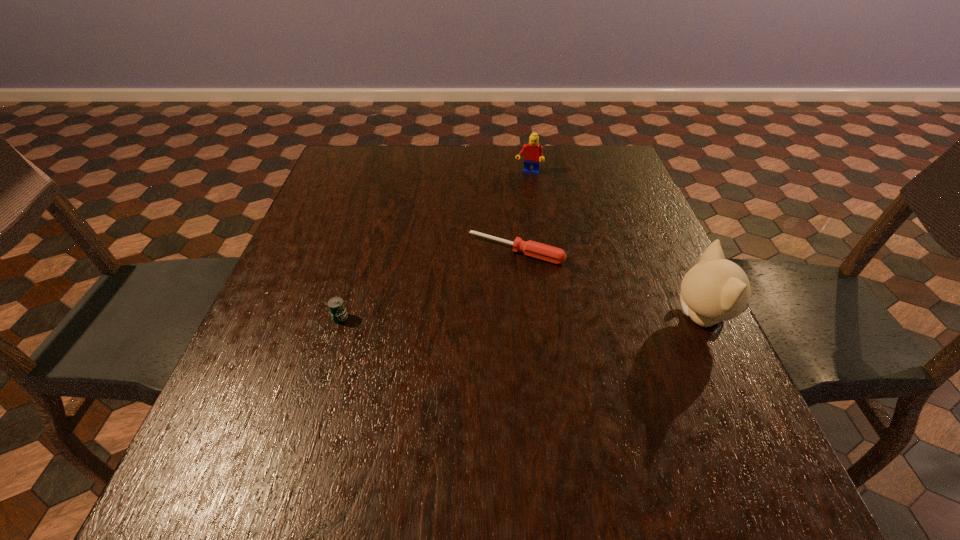
I want to click on unoccupied position between the shortest object and the farthest object, so click(x=522, y=212).

Where is `vacant area between the beer can and the rightmost object`? The height and width of the screenshot is (540, 960). vacant area between the beer can and the rightmost object is located at coordinates (520, 318).

Where is `vacant area between the leftmost object and the rightmost object`? The height and width of the screenshot is (540, 960). vacant area between the leftmost object and the rightmost object is located at coordinates click(x=520, y=318).

Identify the location of empty location between the third nearest object and the Lego. The width and height of the screenshot is (960, 540). (522, 212).

Find the location of a particular element. Image resolution: width=960 pixels, height=540 pixels. free spot between the shortest object and the Lego is located at coordinates (522, 212).

Locate which object is the closest to the kitten. Please provide its 2D coordinates. Your answer should be formatted as a tuple, i.e. [(x, y)], where the tuple contains the x and y coordinates of a point satisfying the conditions above.

[(544, 252)]

You are a GUI agent. You are given a task and a screenshot of the screen. Output one action in this format:
    pyautogui.click(x=<x>, y=<y>)
    Task: Click on the third closest object relative to the leftmost object
    The image size is (960, 540).
    Given the screenshot: What is the action you would take?
    pyautogui.click(x=716, y=289)

Image resolution: width=960 pixels, height=540 pixels. Find the location of `blank area in the image that satisfies the following two spatial constraints: 1. on the front side of the screwdriver; 2. on the face of the tallest object`. blank area in the image that satisfies the following two spatial constraints: 1. on the front side of the screwdriver; 2. on the face of the tallest object is located at coordinates (522, 319).

Locate an element on the screen. The height and width of the screenshot is (540, 960). vacant region that satisfies the following two spatial constraints: 1. on the front side of the third shortest object; 2. on the face of the tallest object is located at coordinates (550, 319).